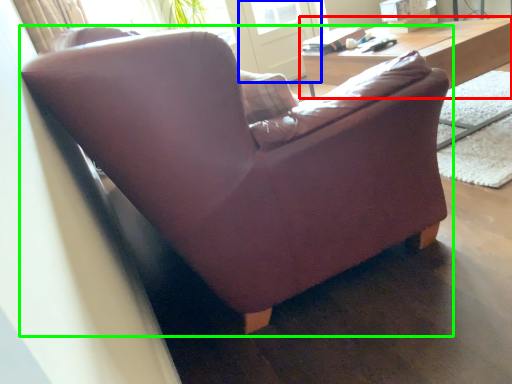
Question: Which object is positioned closest to table (highlighted by a red box)? Select from screen door (highlighted by a blue box) and studio couch (highlighted by a green box).

Choices:
 (A) screen door
 (B) studio couch

Answer: (B)